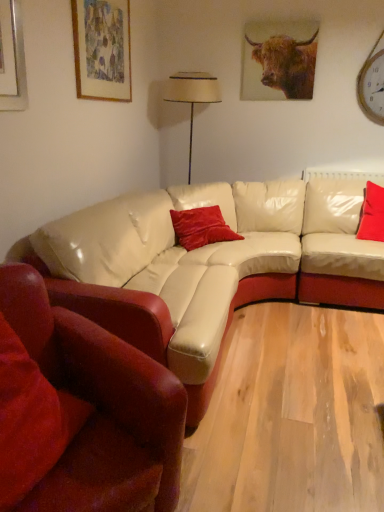
Question: Is velvet red pillow at right, the third pillow when ordered from front to back, outside matte paper picture frame at upper left?

Choices:
 (A) no
 (B) yes

Answer: (B)

Question: Can you confirm if velvet red pillow at right, arranged as the third pillow when viewed from the left, is wider than matte paper picture frame at upper left?

Choices:
 (A) yes
 (B) no

Answer: (A)

Question: Does velvet red pillow at right, arranged as the third pillow when viewed from the left, have a smaller size compared to matte paper picture frame at upper left?

Choices:
 (A) yes
 (B) no

Answer: (B)

Question: Is velvet red pillow at right, placed as the first pillow when sorted from top to bottom, to the right of matte paper picture frame at upper left from the viewer's perspective?

Choices:
 (A) yes
 (B) no

Answer: (A)

Question: Considering the relative positions of velvet red pillow at right, arranged as the third pillow when viewed from the left, and matte paper picture frame at upper left in the image provided, is velvet red pillow at right, arranged as the third pillow when viewed from the left, to the left of matte paper picture frame at upper left from the viewer's perspective?

Choices:
 (A) yes
 (B) no

Answer: (B)

Question: In terms of size, does brown textured bull at upper center appear bigger or smaller than matte paper picture frame at upper left?

Choices:
 (A) small
 (B) big

Answer: (A)

Question: From a real-world perspective, is brown textured bull at upper center physically located above or below matte paper picture frame at upper left?

Choices:
 (A) above
 (B) below

Answer: (B)

Question: Considering their positions, is brown textured bull at upper center located in front of or behind matte paper picture frame at upper left?

Choices:
 (A) behind
 (B) front

Answer: (A)

Question: Visually, is brown textured bull at upper center positioned to the left or to the right of matte paper picture frame at upper left?

Choices:
 (A) left
 (B) right

Answer: (B)

Question: In terms of width, does matte paper picture frame at upper left look wider or thinner when compared to velvet red pillow at lower left, which appears as the 1th pillow when viewed from the left?

Choices:
 (A) wide
 (B) thin

Answer: (B)

Question: Considering the positions of matte paper picture frame at upper left and velvet red pillow at lower left, marked as the first pillow in a bottom-to-top arrangement, in the image, is matte paper picture frame at upper left taller or shorter than velvet red pillow at lower left, marked as the first pillow in a bottom-to-top arrangement,?

Choices:
 (A) tall
 (B) short

Answer: (A)

Question: Is matte paper picture frame at upper left spatially inside velvet red pillow at lower left, which is counted as the third pillow, starting from the right, or outside of it?

Choices:
 (A) inside
 (B) outside

Answer: (B)

Question: In terms of size, does matte paper picture frame at upper left appear bigger or smaller than velvet red pillow at lower left, marked as the first pillow in a bottom-to-top arrangement?

Choices:
 (A) big
 (B) small

Answer: (B)

Question: From the image's perspective, is velvet red pillow at right, arranged as the third pillow when viewed from the left, located above or below brown textured bull at upper center?

Choices:
 (A) above
 (B) below

Answer: (B)

Question: Considering the positions of point (379, 200) and point (281, 53), is point (379, 200) closer or farther from the camera than point (281, 53)?

Choices:
 (A) closer
 (B) farther

Answer: (A)